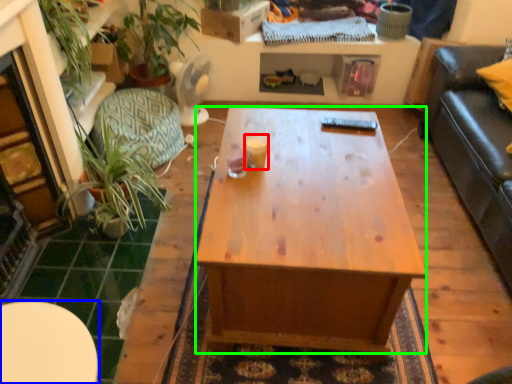
Question: Estimate the real-world distances between objects in this image. Which object is closer to coffee cup (highlighted by a red box), table (highlighted by a blue box) or desk (highlighted by a green box)?

Choices:
 (A) table
 (B) desk

Answer: (B)